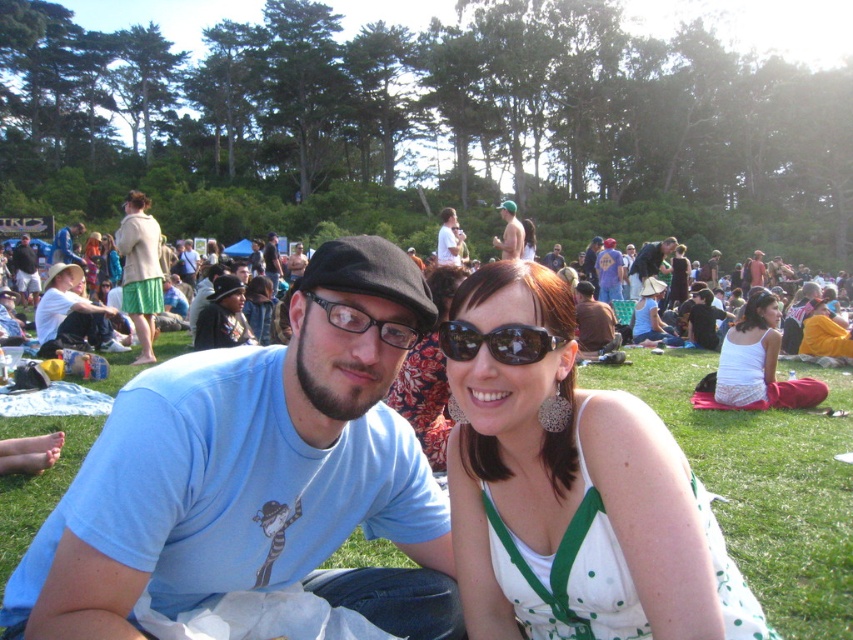
You are a photographer standing at the center of the scene. You want to take a photo of the white dotted dress at center. Which direction should you move to get a better shot?

The white dotted dress at center is already at the center of the scene, so you don not need to move to capture it in your photo.

You are a photographer at the festival trying to frame a shot of the white dotted dress at center and the skinny man at center. Which one should you adjust your camera angle to focus on first if you want to capture both in a single shot without moving the camera?

The white dotted dress at center is not as tall as the skinny man at center, so you should focus on the white dotted dress at center first to ensure it is in frame before the taller skinny man at center blocks it.

You are a photographer trying to capture a closeup shot of the matte black sunglasses at center. However, the matte beige jacket at upper left is blocking your view. Can you estimate whether the jacket is large enough to fully obscure the sunglasses from your current angle?

The matte beige jacket at upper left is larger in size than matte black sunglasses at center, so yes, the jacket is likely large enough to fully obscure the sunglasses from your current angle.